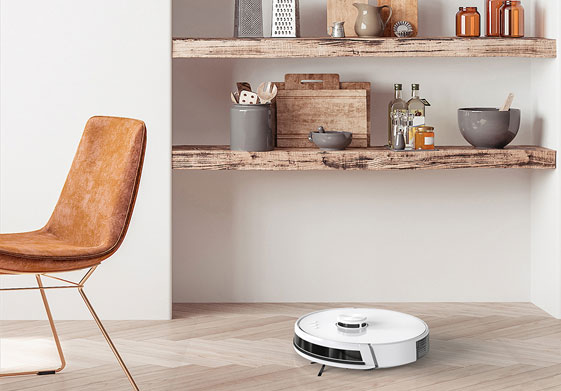
This screenshot has height=391, width=561. In order to click on bottle in this screenshot , I will do `click(415, 101)`.